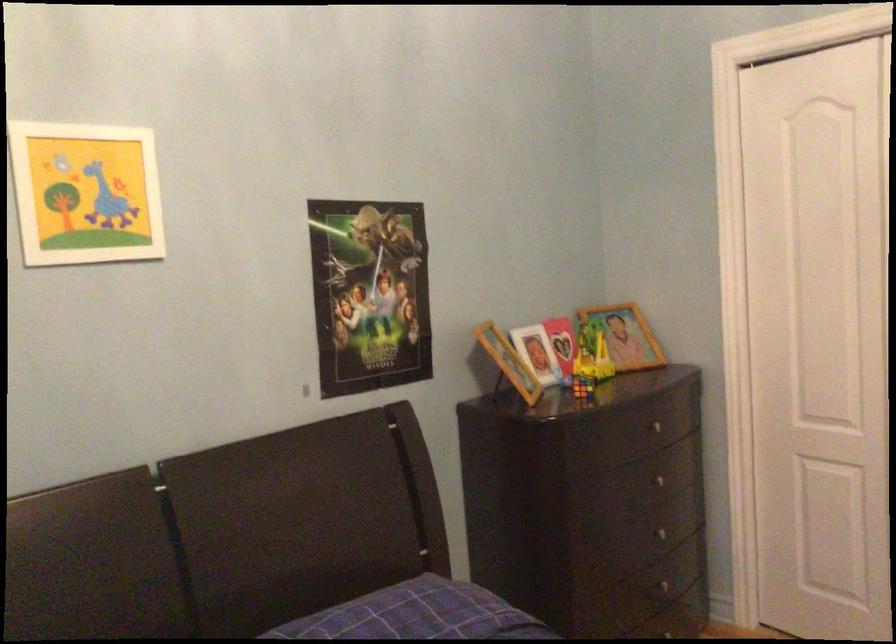
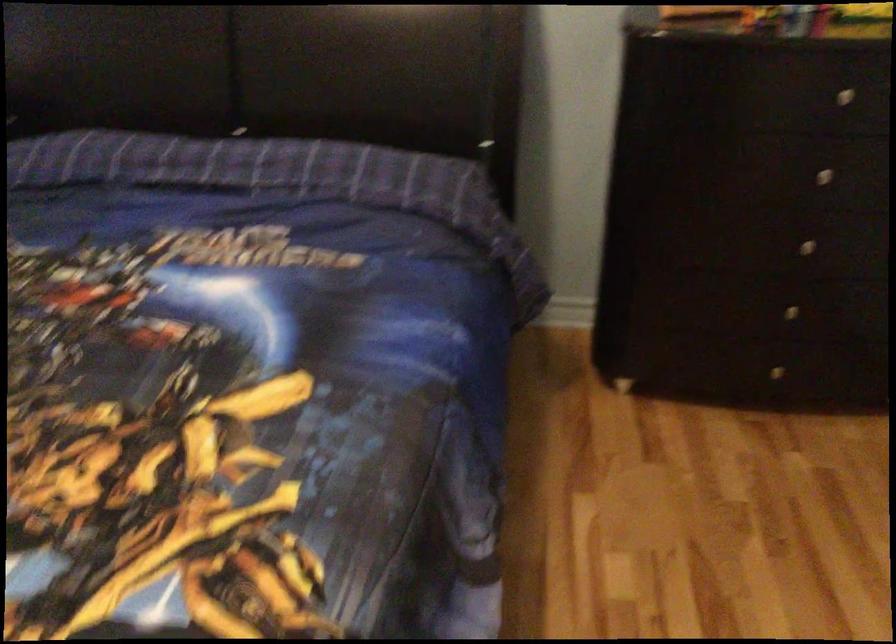
The point at (668, 536) is marked in the first image. Where is the corresponding point in the second image?

(805, 245)